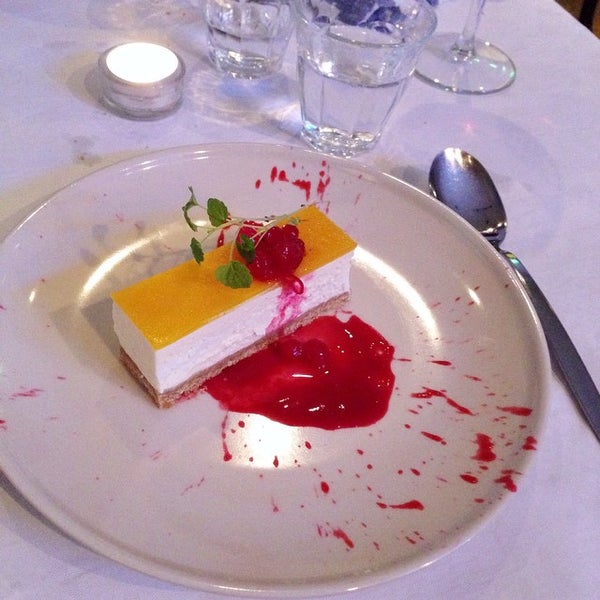
Locate an element on the screen. The image size is (600, 600). candle is located at coordinates (137, 74).